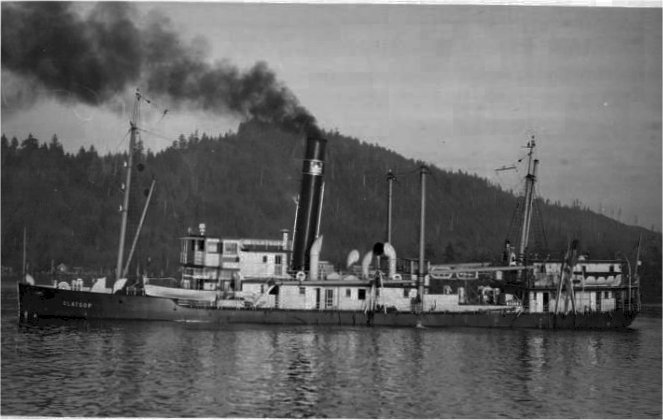
I want to click on windows, so [x=361, y=291], [x=328, y=296].